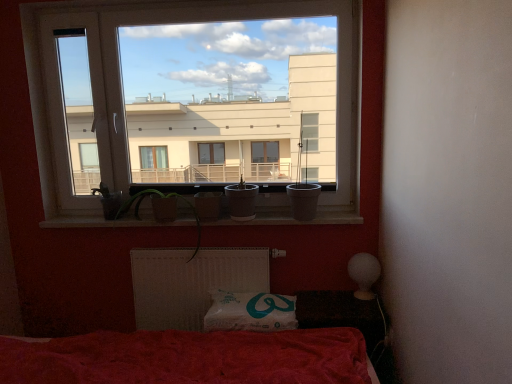
Question: Considering the relative sizes of matte white pot at center and smooth concrete window sill at center in the image provided, is matte white pot at center shorter than smooth concrete window sill at center?

Choices:
 (A) no
 (B) yes

Answer: (A)

Question: Is matte white pot at center positioned with its back to smooth concrete window sill at center?

Choices:
 (A) yes
 (B) no

Answer: (B)

Question: Does matte white pot at center come in front of smooth concrete window sill at center?

Choices:
 (A) no
 (B) yes

Answer: (B)

Question: Is matte white pot at center placed right next to smooth concrete window sill at center?

Choices:
 (A) yes
 (B) no

Answer: (B)

Question: Does matte white pot at center have a lesser width compared to smooth concrete window sill at center?

Choices:
 (A) no
 (B) yes

Answer: (A)

Question: From the image's perspective, is matte white pot at center beneath smooth concrete window sill at center?

Choices:
 (A) no
 (B) yes

Answer: (A)

Question: Considering the relative sizes of smooth concrete window sill at center and matte white pot at center in the image provided, is smooth concrete window sill at center shorter than matte white pot at center?

Choices:
 (A) no
 (B) yes

Answer: (B)

Question: From a real-world perspective, is smooth concrete window sill at center over matte white pot at center?

Choices:
 (A) yes
 (B) no

Answer: (B)

Question: Is smooth concrete window sill at center behind matte white pot at center?

Choices:
 (A) yes
 (B) no

Answer: (A)

Question: Considering the relative positions of smooth concrete window sill at center and matte white pot at center in the image provided, is smooth concrete window sill at center to the right of matte white pot at center from the viewer's perspective?

Choices:
 (A) no
 (B) yes

Answer: (A)

Question: From the image's perspective, would you say smooth concrete window sill at center is positioned over matte white pot at center?

Choices:
 (A) no
 (B) yes

Answer: (A)

Question: From a real-world perspective, is smooth concrete window sill at center positioned under matte white pot at center based on gravity?

Choices:
 (A) no
 (B) yes

Answer: (B)

Question: From a real-world perspective, is transparent glass window at upper center on top of smooth concrete window sill at center?

Choices:
 (A) yes
 (B) no

Answer: (A)